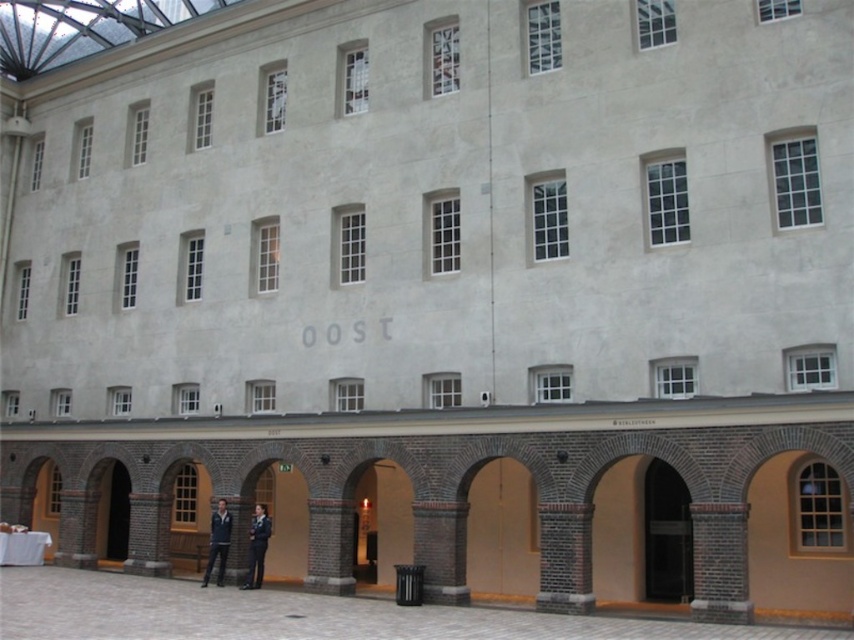
You are standing in the courtyard of a modern building. There is a point marked at coordinates (258,570). If you want to take a photo of this point from your current position, will the camera need to be zoomed in or out to capture it clearly?

The point at (258,570) is 47.25 meters away from the camera. Since this distance is quite far, the camera will likely need to be zoomed in to capture the point clearly.

You are an employee at this building and need to hang a new sign above the entrance. The sign requires a clear space above the dark blue uniform at center and the dark blue jacket at center. Which object should the sign be placed above to ensure it is visible?

The sign should be placed above the dark blue jacket at center because the dark blue uniform at center is in front of it, so placing the sign above the jacket would ensure visibility over the uniform.